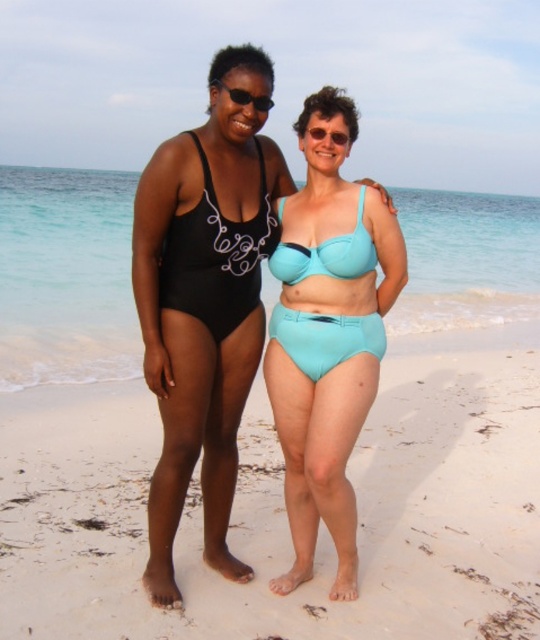
Question: Which point is closer to the camera?

Choices:
 (A) 332,314
 (B) 251,260
 (C) 361,232
 (D) 253,589

Answer: (C)

Question: Is black matte swimsuit at center behind matte blue bikini top at center?

Choices:
 (A) yes
 (B) no

Answer: (B)

Question: Does white sand at center have a smaller size compared to matte blue bikini at center?

Choices:
 (A) no
 (B) yes

Answer: (B)

Question: Which object is the closest to the teal matte bikini at center?

Choices:
 (A) transparent plastic goggles at center
 (B) white sand at center
 (C) matte blue bikini at center

Answer: (C)

Question: Which point is farther to the camera?

Choices:
 (A) (235, 92)
 (B) (279, 272)

Answer: (B)

Question: Is matte black swimsuit at center positioned in front of matte blue bikini top at center?

Choices:
 (A) yes
 (B) no

Answer: (A)